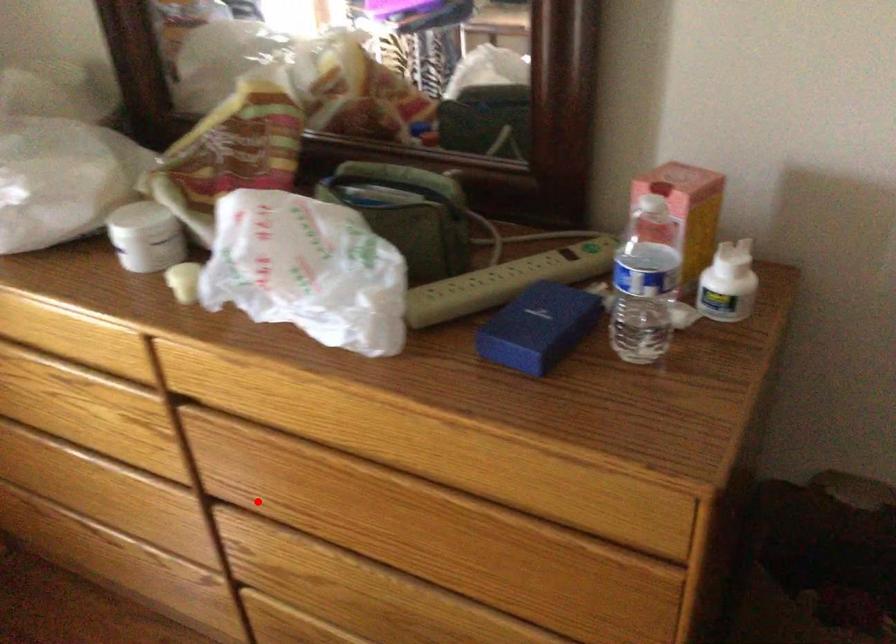
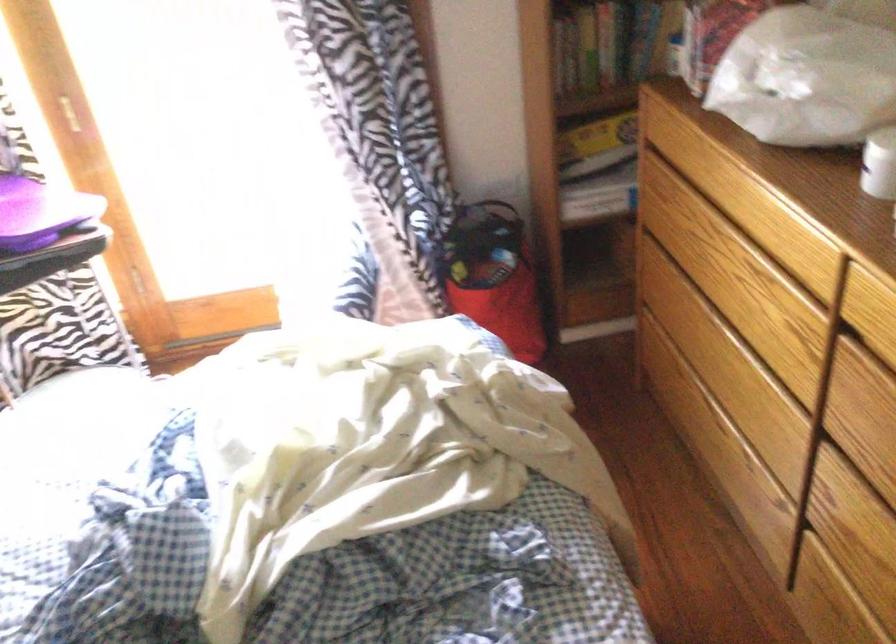
In the second image, find the point that corresponds to the highlighted location in the first image.

(868, 460)